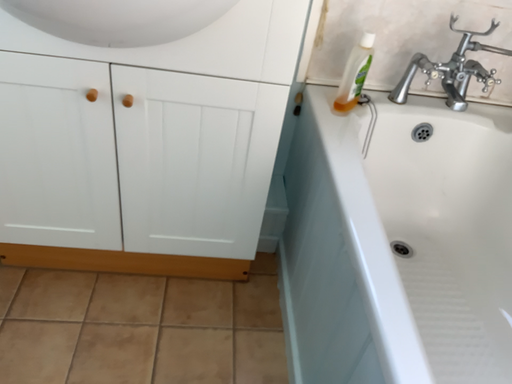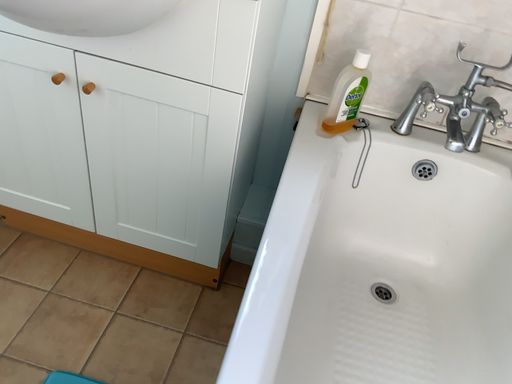
Question: How did the camera likely rotate when shooting the video?

Choices:
 (A) rotated right
 (B) rotated left

Answer: (B)